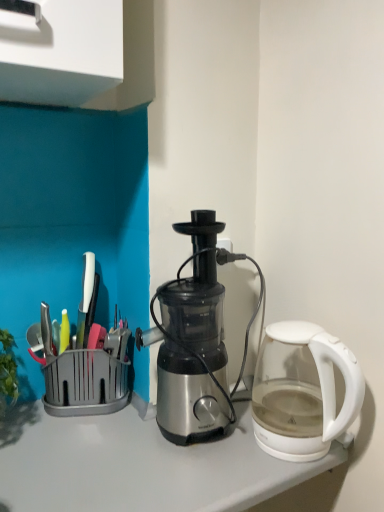
What do you see at coordinates (195, 339) in the screenshot?
I see `metallic silver juicer at center` at bounding box center [195, 339].

This screenshot has height=512, width=384. Identify the location of metallic silver juicer at center. (195, 339).

I want to click on transparent glass kettle at right, so click(x=302, y=391).

What do you see at coordinates (302, 391) in the screenshot?
I see `transparent glass kettle at right` at bounding box center [302, 391].

I want to click on metallic silver juicer at center, so click(195, 339).

Which object is positioned more to the right, metallic silver juicer at center or transparent glass kettle at right?

transparent glass kettle at right is more to the right.

Which is behind, metallic silver juicer at center or transparent glass kettle at right?

Positioned behind is metallic silver juicer at center.

Which is farther, (200, 289) or (299, 452)?

The point (200, 289) is farther.

From the image's perspective, is metallic silver juicer at center above or below transparent glass kettle at right?

metallic silver juicer at center is above transparent glass kettle at right.

From a real-world perspective, which object stands above the other?

metallic silver juicer at center.

Is metallic silver juicer at center thinner than transparent glass kettle at right?

Yes, metallic silver juicer at center is thinner than transparent glass kettle at right.

Which of these two, metallic silver juicer at center or transparent glass kettle at right, stands taller?

metallic silver juicer at center.

Is metallic silver juicer at center bigger than transparent glass kettle at right?

Yes, metallic silver juicer at center is bigger than transparent glass kettle at right.

Is metallic silver juicer at center positioned beyond the bounds of transparent glass kettle at right?

Result: metallic silver juicer at center lies outside transparent glass kettle at right's area.

Is metallic silver juicer at center positioned far away from transparent glass kettle at right?

Actually, metallic silver juicer at center and transparent glass kettle at right are a little close together.

Is metallic silver juicer at center looking in the opposite direction of transparent glass kettle at right?

metallic silver juicer at center is not turned away from transparent glass kettle at right.

This screenshot has width=384, height=512. What are the coordinates of `coffee maker located above the transparent glass kettle at right (from a real-world perspective)` in the screenshot? It's located at (195, 339).

Would you say transparent glass kettle at right is to the left or to the right of metallic silver juicer at center in the picture?

Based on their positions, transparent glass kettle at right is located to the right of metallic silver juicer at center.

Between transparent glass kettle at right and metallic silver juicer at center, which one is positioned behind?

metallic silver juicer at center.

Is point (282, 437) closer or farther from the camera than point (180, 416)?

Point (282, 437) is closer to the camera than point (180, 416).

From the image's perspective, is transparent glass kettle at right below metallic silver juicer at center?

Yes, from the image's perspective, transparent glass kettle at right is below metallic silver juicer at center.

From a real-world perspective, is transparent glass kettle at right over metallic silver juicer at center?

No.

Can you confirm if transparent glass kettle at right is thinner than metallic silver juicer at center?

No, transparent glass kettle at right is not thinner than metallic silver juicer at center.

From their relative heights in the image, would you say transparent glass kettle at right is taller or shorter than metallic silver juicer at center?

transparent glass kettle at right is shorter than metallic silver juicer at center.

Can you confirm if transparent glass kettle at right is bigger than metallic silver juicer at center?

Incorrect, transparent glass kettle at right is not larger than metallic silver juicer at center.

Is transparent glass kettle at right situated inside metallic silver juicer at center or outside?

The correct answer is: outside.

Is transparent glass kettle at right next to metallic silver juicer at center and touching it?

transparent glass kettle at right and metallic silver juicer at center are clearly separated.

Could you tell me if transparent glass kettle at right is turned towards metallic silver juicer at center?

No, transparent glass kettle at right is not facing towards metallic silver juicer at center.

Can you tell me how much transparent glass kettle at right and metallic silver juicer at center differ in facing direction?

The facing directions of transparent glass kettle at right and metallic silver juicer at center are 5.53 degrees apart.

This screenshot has width=384, height=512. Identify the location of coffee maker located on the left of transparent glass kettle at right. (195, 339).

Identify the location of coffee maker behind the transparent glass kettle at right. (195, 339).

Identify the location of coffee maker above the transparent glass kettle at right (from a real-world perspective). The width and height of the screenshot is (384, 512). (195, 339).